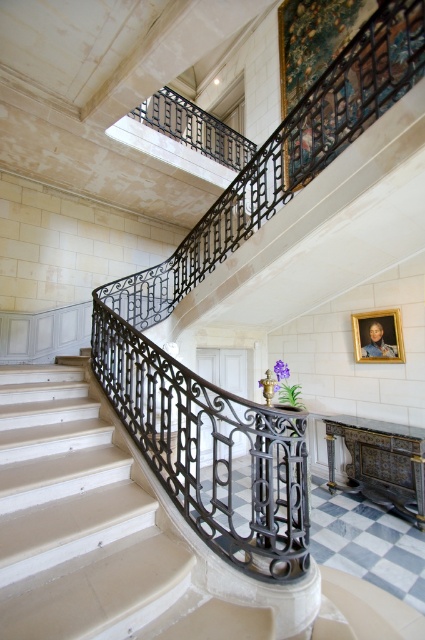
Question: Can you confirm if black wrought iron railing at center is positioned to the right of gold-framed portrait at upper center?

Choices:
 (A) yes
 (B) no

Answer: (B)

Question: Which point is closer to the camera?

Choices:
 (A) (110, 362)
 (B) (379, 342)

Answer: (A)

Question: In this image, where is polished marble stairs at center located relative to black wrought iron railing at center?

Choices:
 (A) below
 (B) above

Answer: (A)

Question: Is polished marble stairs at center below gold-framed portrait at upper center?

Choices:
 (A) no
 (B) yes

Answer: (B)

Question: Among these points, which one is farthest from the camera?

Choices:
 (A) (142, 429)
 (B) (11, 476)

Answer: (A)

Question: Estimate the real-world distances between objects in this image. Which object is closer to the gold-framed portrait at upper center?

Choices:
 (A) black wrought iron railing at center
 (B) polished marble stairs at center

Answer: (A)